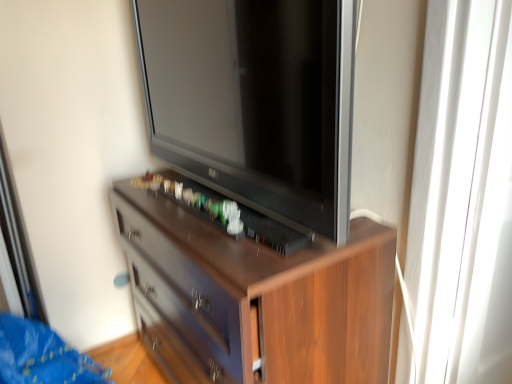
Question: Considering the positions of transparent glass door at right and satin black television at center in the image, is transparent glass door at right taller or shorter than satin black television at center?

Choices:
 (A) short
 (B) tall

Answer: (B)

Question: Looking at their shapes, would you say transparent glass door at right is wider or thinner than satin black television at center?

Choices:
 (A) wide
 (B) thin

Answer: (B)

Question: Which of these objects is positioned closest to the satin black television at center?

Choices:
 (A) transparent glass door at right
 (B) brown wood chest of drawers at center

Answer: (B)

Question: Estimate the real-world distances between objects in this image. Which object is farther from the satin black television at center?

Choices:
 (A) brown wood chest of drawers at center
 (B) transparent glass door at right

Answer: (B)